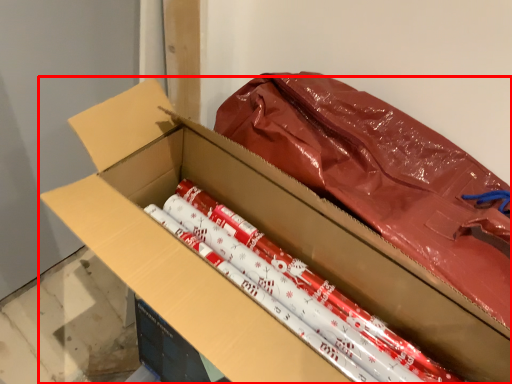
Question: Where is box (annotated by the red box) located in relation to crayon in the image?

Choices:
 (A) left
 (B) right

Answer: (A)